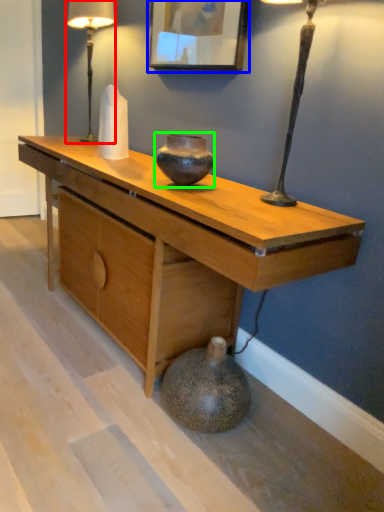
Question: Which is nearer to the table lamp (highlighted by a red box)? picture frame (highlighted by a blue box) or vase (highlighted by a green box).

Choices:
 (A) picture frame
 (B) vase

Answer: (A)